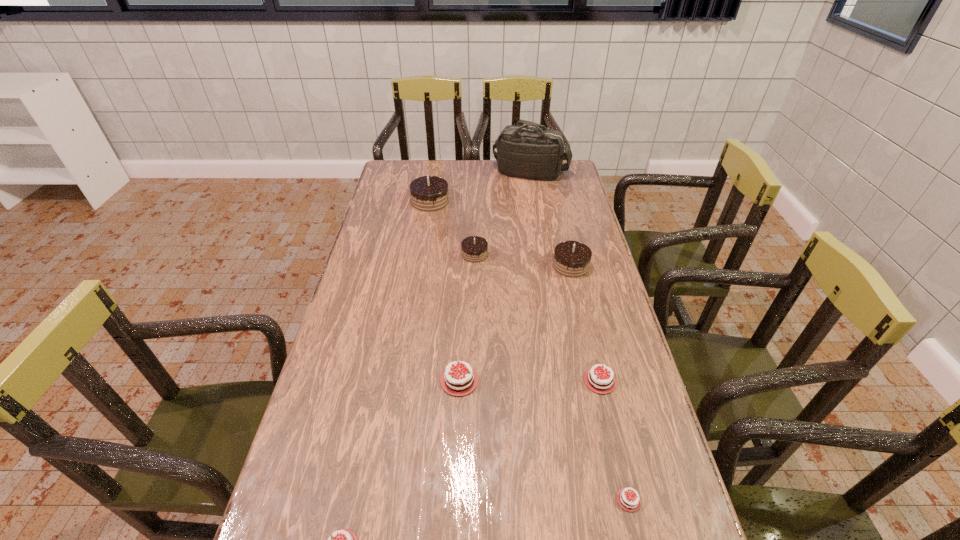
Where is `shoulder bag`? The image size is (960, 540). shoulder bag is located at coordinates (536, 152).

Locate an element on the screen. The width and height of the screenshot is (960, 540). the farthest object is located at coordinates (536, 152).

Image resolution: width=960 pixels, height=540 pixels. Find the location of `the seventh nearest object`. the seventh nearest object is located at coordinates tap(428, 193).

Identify the location of the farthest chocolate chocolate cake. This screenshot has height=540, width=960. (428, 193).

Identify the location of the rightmost chocolate chocolate cake. The height and width of the screenshot is (540, 960). (571, 258).

The image size is (960, 540). What are the coordinates of `the second tallest chocolate cake` in the screenshot? It's located at (571, 258).

Where is `the smallest chocolate chocolate cake`? The image size is (960, 540). the smallest chocolate chocolate cake is located at coordinates (474, 248).

The width and height of the screenshot is (960, 540). In order to click on the third tallest chocolate cake in this screenshot , I will do `click(474, 248)`.

The width and height of the screenshot is (960, 540). Identify the location of the biggest red chocolate cake. (461, 381).

At what (x,y) coordinates should I click in order to perform the action: click on the third red chocolate cake from right to left. Please return your answer as a coordinate pair (x, y). The height and width of the screenshot is (540, 960). Looking at the image, I should click on (461, 381).